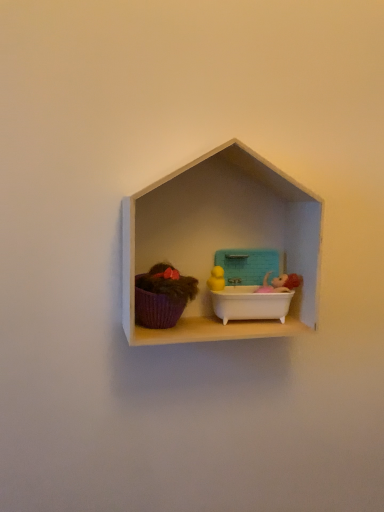
Question: Is white matte shelf at center in front of or behind teal plastic lunch box at center in the image?

Choices:
 (A) behind
 (B) front

Answer: (B)

Question: From a real-world perspective, relative to teal plastic lunch box at center, is white matte shelf at center vertically above or below?

Choices:
 (A) below
 (B) above

Answer: (B)

Question: Which of these objects is positioned farthest from the teal plastic lunch box at center?

Choices:
 (A) purple fabric basket at left
 (B) white matte shelf at center

Answer: (A)

Question: Estimate the real-world distances between objects in this image. Which object is closer to the teal plastic lunch box at center?

Choices:
 (A) white matte shelf at center
 (B) purple fabric basket at left

Answer: (A)